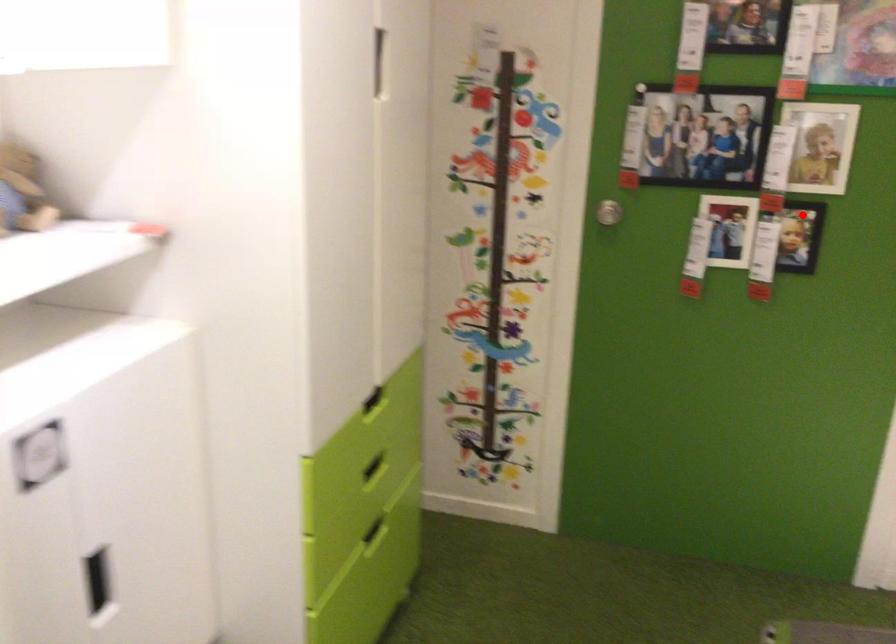
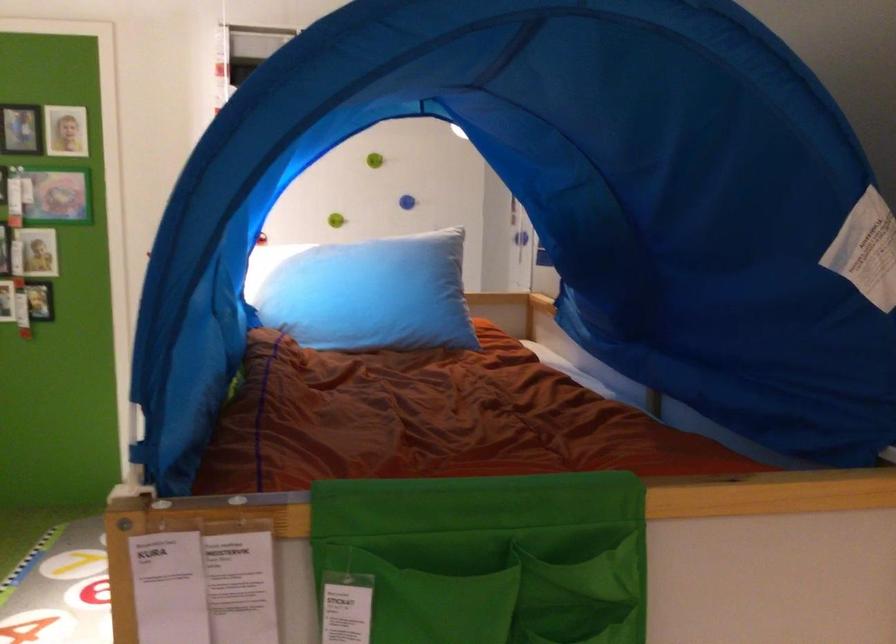
Where in the second image is the point corresponding to the highlighted location from the first image?

(39, 301)